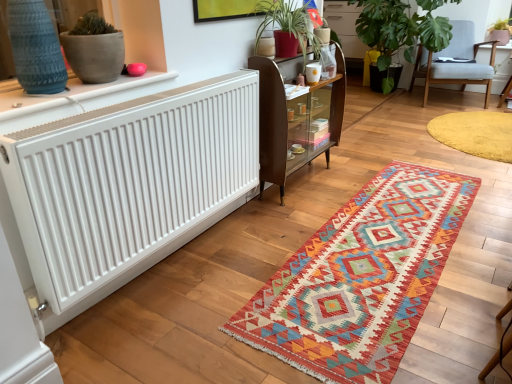
Image resolution: width=512 pixels, height=384 pixels. Identify the location of wooden glass-fronted cabinet at center. (295, 121).

Locate an element on the screen. This screenshot has width=512, height=384. pink matte pot at upper right, which is counted as the 2th houseplant, starting from the left is located at coordinates (500, 32).

Where is `white textured radiator at upper left`? white textured radiator at upper left is located at coordinates (70, 94).

How much space does green leafy plant at upper right, the 2th houseplant when ordered from right to left, occupy vertically?

green leafy plant at upper right, the 2th houseplant when ordered from right to left, is 37.60 inches in height.

This screenshot has width=512, height=384. Find the location of `knitted woolen rug at center, the second mat when ordered from right to left`. knitted woolen rug at center, the second mat when ordered from right to left is located at coordinates (361, 278).

I want to click on yellow plush rug at lower right, the first mat when ordered from back to front, so click(x=475, y=133).

Locate an element on the screen. light gray fabric chair at upper right is located at coordinates (455, 63).

Where is `wooden glass-fronted cabinet at center`? wooden glass-fronted cabinet at center is located at coordinates (295, 121).

Is the position of yellow plush rug at lower right, the first mat when ordered from back to front, less distant than that of knitted woolen rug at center, the second mat when ordered from right to left?

No, it is not.

Between yellow plush rug at lower right, the first mat when ordered from back to front, and knitted woolen rug at center, which ranks as the first mat in front-to-back order, which one has larger size?

knitted woolen rug at center, which ranks as the first mat in front-to-back order.

Between pink matte pot at upper right, which is counted as the 2th houseplant, starting from the left, and yellow plush rug at lower right, which is the 1th mat from top to bottom, which one has larger width?

Wider between the two is yellow plush rug at lower right, which is the 1th mat from top to bottom.

Is pink matte pot at upper right, which ranks as the 1th houseplant in right-to-left order, aimed at yellow plush rug at lower right, placed as the 2th mat when sorted from left to right?

Yes.

Between point (495, 33) and point (465, 151), which one is positioned behind?

The point (495, 33) is behind.

Would you say pink matte pot at upper right, which ranks as the 1th houseplant in right-to-left order, is to the left or to the right of yellow plush rug at lower right, placed as the 2th mat when sorted from left to right, in the picture?

pink matte pot at upper right, which ranks as the 1th houseplant in right-to-left order, is positioned on yellow plush rug at lower right, placed as the 2th mat when sorted from left to right,'s right side.

Is light gray fabric chair at upper right aimed at knitted woolen rug at center, placed as the 2th mat when sorted from back to front?

Yes, light gray fabric chair at upper right is facing knitted woolen rug at center, placed as the 2th mat when sorted from back to front.

Based on the photo, does light gray fabric chair at upper right have a larger size compared to knitted woolen rug at center, which is the 1th mat from bottom to top?

Correct, light gray fabric chair at upper right is larger in size than knitted woolen rug at center, which is the 1th mat from bottom to top.

Which object is thinner, light gray fabric chair at upper right or knitted woolen rug at center, which is the 1th mat in left-to-right order?

Thinner between the two is knitted woolen rug at center, which is the 1th mat in left-to-right order.

I want to click on mat that is the 2nd object to the left of the light gray fabric chair at upper right, starting at the anchor, so click(361, 278).

From a real-world perspective, is white textured radiator at upper left physically above yellow plush rug at lower right, which is the 2th mat from bottom to top?

Yes.

Which object is wider, white textured radiator at upper left or yellow plush rug at lower right, placed as the first mat when sorted from right to left?

Wider between the two is yellow plush rug at lower right, placed as the first mat when sorted from right to left.

Which is in front, white textured radiator at upper left or yellow plush rug at lower right, which is the 1th mat from top to bottom?

white textured radiator at upper left.

Based on the photo, from the image's perspective, is white textured radiator at upper left located beneath yellow plush rug at lower right, the first mat when ordered from back to front?

Correct, white textured radiator at upper left appears lower than yellow plush rug at lower right, the first mat when ordered from back to front, in the image.

Between yellow plush rug at lower right, placed as the 2th mat when sorted from left to right, and pink matte pot at upper right, which is counted as the 2th houseplant, starting from the left, which one appears on the right side from the viewer's perspective?

Positioned to the right is pink matte pot at upper right, which is counted as the 2th houseplant, starting from the left.

Does yellow plush rug at lower right, placed as the 2th mat when sorted from left to right, have a greater height compared to pink matte pot at upper right, which ranks as the 1th houseplant in right-to-left order?

No.

Considering the positions of objects yellow plush rug at lower right, which is the 2th mat from bottom to top, and pink matte pot at upper right, which ranks as the 1th houseplant in right-to-left order, in the image provided, who is behind, yellow plush rug at lower right, which is the 2th mat from bottom to top, or pink matte pot at upper right, which ranks as the 1th houseplant in right-to-left order,?

pink matte pot at upper right, which ranks as the 1th houseplant in right-to-left order, is more distant.

Are yellow plush rug at lower right, positioned as the second mat in front-to-back order, and pink matte pot at upper right, which ranks as the 1th houseplant in right-to-left order, far apart?

Absolutely, yellow plush rug at lower right, positioned as the second mat in front-to-back order, is distant from pink matte pot at upper right, which ranks as the 1th houseplant in right-to-left order.

From the image's perspective, between light gray fabric chair at upper right and green leafy plant at upper right, the 1th houseplant when ordered from left to right, which one is located above?

green leafy plant at upper right, the 1th houseplant when ordered from left to right, is shown above in the image.

Could you measure the distance between light gray fabric chair at upper right and green leafy plant at upper right, the 2th houseplant when ordered from right to left?

light gray fabric chair at upper right and green leafy plant at upper right, the 2th houseplant when ordered from right to left, are 16.67 inches apart.

Find the location of a particular element. houseplant lying on the left of light gray fabric chair at upper right is located at coordinates (401, 28).

Is green leafy plant at upper right, the 1th houseplant when ordered from left to right, at the back of light gray fabric chair at upper right?

Yes.

From the image's perspective, is white matte radiator at left located above wooden glass-fronted cabinet at center?

Incorrect, from the image's perspective, white matte radiator at left is lower than wooden glass-fronted cabinet at center.

Can we say white matte radiator at left lies outside wooden glass-fronted cabinet at center?

Absolutely, white matte radiator at left is external to wooden glass-fronted cabinet at center.

Considering the positions of point (116, 176) and point (293, 110), is point (116, 176) closer or farther from the camera than point (293, 110)?

Point (116, 176) appears to be closer to the viewer than point (293, 110).

Which of these two, white matte radiator at left or wooden glass-fronted cabinet at center, stands shorter?

With less height is white matte radiator at left.

Find the location of a particular element. This screenshot has height=384, width=512. mat on the left of yellow plush rug at lower right, the first mat when ordered from back to front is located at coordinates (361, 278).

Image resolution: width=512 pixels, height=384 pixels. Identify the location of the 1st mat positioned below the pink matte pot at upper right, which is counted as the 2th houseplant, starting from the left (from a real-world perspective). (475, 133).

From the image, which object appears to be nearer to yellow plush rug at lower right, positioned as the second mat in front-to-back order, green leafy plant at upper right, the 1th houseplant when ordered from left to right, or wooden glass-fronted cabinet at center?

green leafy plant at upper right, the 1th houseplant when ordered from left to right, lies closer to yellow plush rug at lower right, positioned as the second mat in front-to-back order, than the other object.

Based on the photo, which object lies further to the anchor point wooden glass-fronted cabinet at center, green leafy plant at upper right, the 2th houseplant when ordered from right to left, or pink matte pot at upper right, which ranks as the 1th houseplant in right-to-left order?

pink matte pot at upper right, which ranks as the 1th houseplant in right-to-left order.

Estimate the real-world distances between objects in this image. Which object is closer to pink matte pot at upper right, which ranks as the 1th houseplant in right-to-left order, yellow plush rug at lower right, placed as the first mat when sorted from right to left, or wooden glass-fronted cabinet at center?

Based on the image, yellow plush rug at lower right, placed as the first mat when sorted from right to left, appears to be nearer to pink matte pot at upper right, which ranks as the 1th houseplant in right-to-left order.

Which object lies nearer to the anchor point green leafy plant at upper right, the 2th houseplant when ordered from right to left, wooden glass-fronted cabinet at center or white textured radiator at upper left?

wooden glass-fronted cabinet at center lies closer to green leafy plant at upper right, the 2th houseplant when ordered from right to left, than the other object.

When comparing their distances from knitted woolen rug at center, which is the 1th mat from bottom to top, does light gray fabric chair at upper right or white textured radiator at upper left seem further?

Among the two, light gray fabric chair at upper right is located further to knitted woolen rug at center, which is the 1th mat from bottom to top.

Which object lies nearer to the anchor point wooden glass-fronted cabinet at center, white textured radiator at upper left or yellow plush rug at lower right, which is the 1th mat from top to bottom?

Based on the image, white textured radiator at upper left appears to be nearer to wooden glass-fronted cabinet at center.

Based on their spatial positions, is white matte radiator at left or knitted woolen rug at center, which is the 1th mat in left-to-right order, closer to wooden glass-fronted cabinet at center?

white matte radiator at left lies closer to wooden glass-fronted cabinet at center than the other object.

Considering their positions, is pink matte pot at upper right, which is counted as the 2th houseplant, starting from the left, positioned further to white matte radiator at left than light gray fabric chair at upper right?

The object further to white matte radiator at left is pink matte pot at upper right, which is counted as the 2th houseplant, starting from the left.

The width and height of the screenshot is (512, 384). I want to click on shelf situated between white textured radiator at upper left and pink matte pot at upper right, which ranks as the 1th houseplant in right-to-left order, from left to right, so click(x=295, y=121).

This screenshot has height=384, width=512. What are the coordinates of `chair between green leafy plant at upper right, the 1th houseplant when ordered from left to right, and yellow plush rug at lower right, positioned as the second mat in front-to-back order, in the vertical direction` in the screenshot? It's located at (455, 63).

What are the coordinates of `radiator located between white textured radiator at upper left and knitted woolen rug at center, which is the 1th mat from bottom to top, in the left-right direction` in the screenshot? It's located at (x=128, y=185).

You are a GUI agent. You are given a task and a screenshot of the screen. Output one action in this format:
    pyautogui.click(x=<x>, y=<y>)
    Task: Click on the houseplant positioned between wooden glass-fronted cabinet at center and light gray fabric chair at upper right from near to far
    
    Given the screenshot: What is the action you would take?
    pyautogui.click(x=401, y=28)